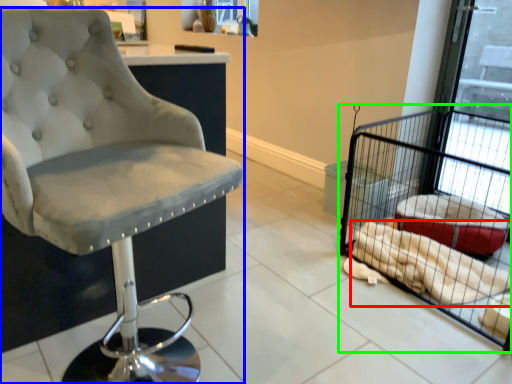
Question: Which object is positioned farthest from material (highlighted by a red box)? Select from chair (highlighted by a blue box) and bird cage (highlighted by a green box).

Choices:
 (A) chair
 (B) bird cage

Answer: (A)